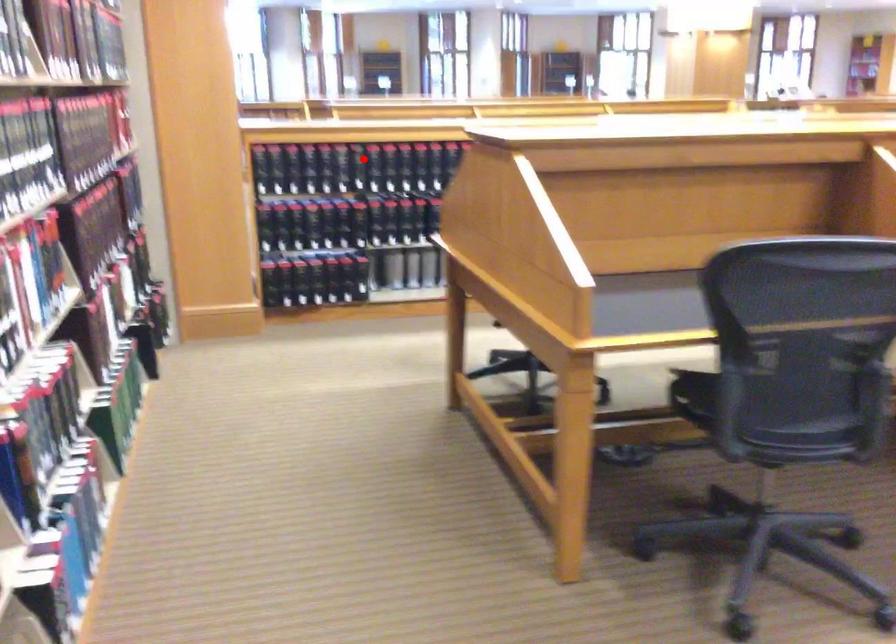
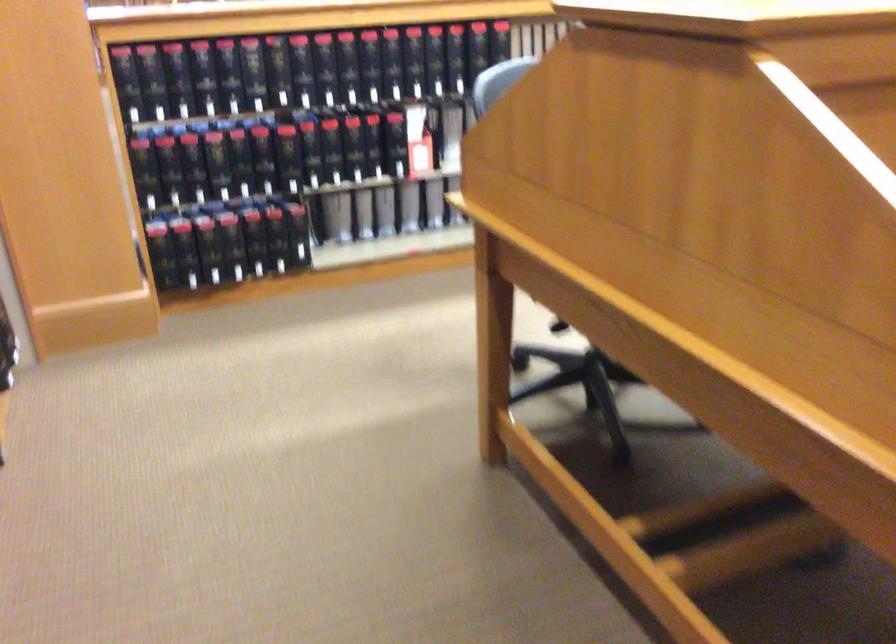
Find the pixel in the second image that matches the highlighted location in the first image.

(291, 71)